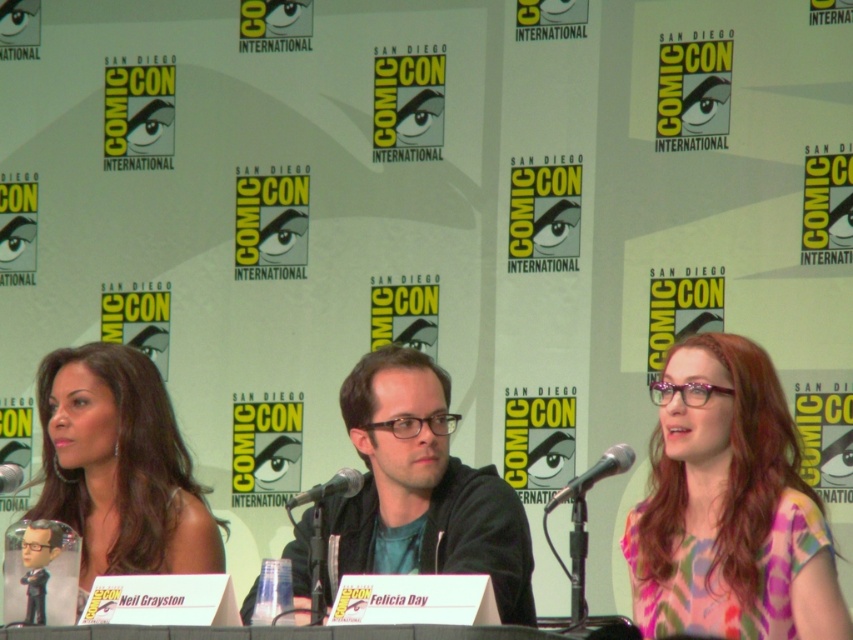
Question: Estimate the real-world distances between objects in this image. Which object is farther from the black matte microphone at center?

Choices:
 (A) multicolored fabric dress at center
 (B) black matte jacket at center
 (C) black plastic microphone at center

Answer: (A)

Question: Among these objects, which one is farthest from the camera?

Choices:
 (A) black matte microphone at center
 (B) metallic silver microphone at center
 (C) multicolored fabric dress at center

Answer: (A)

Question: Which object is closer to the camera taking this photo?

Choices:
 (A) black matte jacket at center
 (B) black matte microphone at center
 (C) shiny black hair at left

Answer: (B)

Question: Can you confirm if multicolored fabric dress at center is positioned to the right of shiny black hair at left?

Choices:
 (A) no
 (B) yes

Answer: (B)

Question: Can you confirm if black matte jacket at center is positioned below black plastic microphone at center?

Choices:
 (A) yes
 (B) no

Answer: (A)

Question: Does shiny black hair at left have a smaller size compared to metallic silver microphone at center?

Choices:
 (A) yes
 (B) no

Answer: (B)